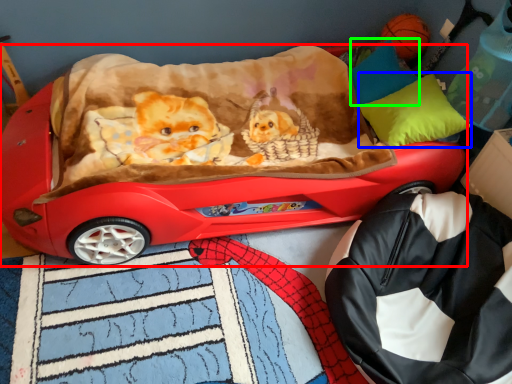
Question: Which is nearer to the car (highlighted by a red box)? pillow (highlighted by a blue box) or pillow (highlighted by a green box).

Choices:
 (A) pillow
 (B) pillow

Answer: (A)